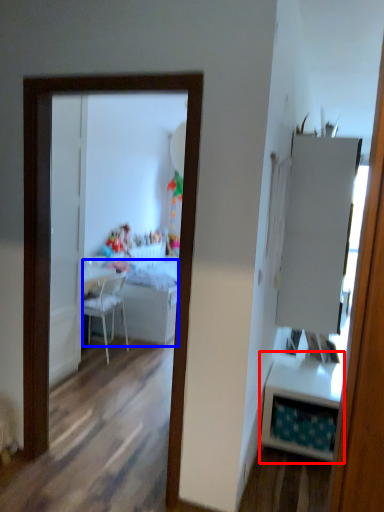
Question: Which object is closer to the camera taking this photo, table (highlighted by a red box) or table (highlighted by a blue box)?

Choices:
 (A) table
 (B) table

Answer: (A)